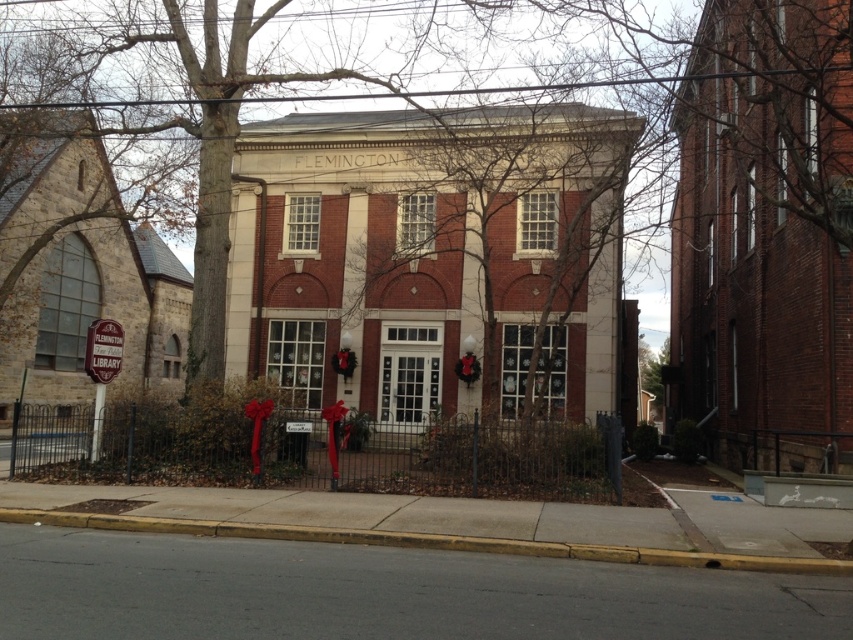
You are standing in front of the FLEMINGTON building and want to walk to the brick church at right. Which direction should you move relative to the brick building at center?

The brick building at center is positioned on the left side of brick church at right, so you should move to the right of the brick building at center to reach the brick church at right.